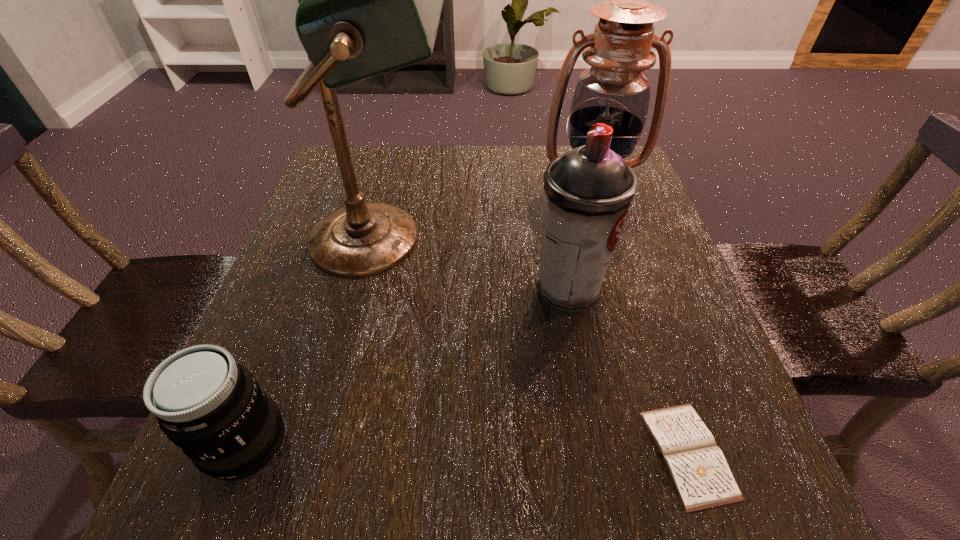
You are a GUI agent. You are given a task and a screenshot of the screen. Output one action in this format:
    pyautogui.click(x=<x>, y=<y>)
    Task: Click on the object that is at the near left corner
    
    Given the screenshot: What is the action you would take?
    pyautogui.click(x=212, y=407)

At what (x,y) coordinates should I click in order to perform the action: click on object situated at the far right corner. Please return your answer as a coordinate pair (x, y). Looking at the image, I should click on (613, 91).

Find the location of a particular element. object located at the near right corner is located at coordinates [x=697, y=467].

I want to click on vacant space at the far edge, so click(437, 189).

Where is `vacant space at the near edge of the desktop`? vacant space at the near edge of the desktop is located at coordinates (366, 494).

Where is `vacant space at the left edge of the desktop`? The height and width of the screenshot is (540, 960). vacant space at the left edge of the desktop is located at coordinates (325, 207).

Find the location of a particular element. The height and width of the screenshot is (540, 960). vacant region at the right edge of the desktop is located at coordinates (616, 264).

The height and width of the screenshot is (540, 960). What are the coordinates of `vacant point at the far left corner` in the screenshot? It's located at [x=391, y=159].

Where is `vacant space at the near right corner of the desktop`? The width and height of the screenshot is (960, 540). vacant space at the near right corner of the desktop is located at coordinates (751, 494).

The height and width of the screenshot is (540, 960). In order to click on empty location between the tallest object and the third shortest object in this screenshot , I will do `click(475, 264)`.